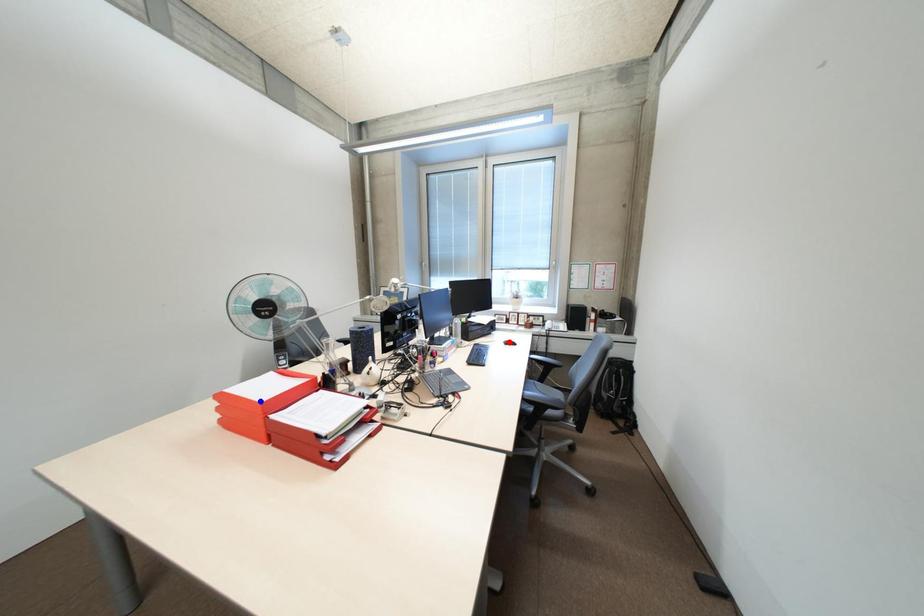
Question: Two points are marked on the image. Which point is closer to the camera?

Choices:
 (A) Blue point is closer.
 (B) Red point is closer.

Answer: (A)